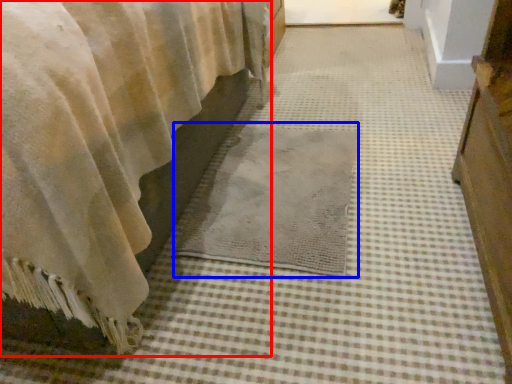
Question: Which of the following is the closest to the observer, curtain (highlighted by a red box) or mat (highlighted by a blue box)?

Choices:
 (A) curtain
 (B) mat

Answer: (A)